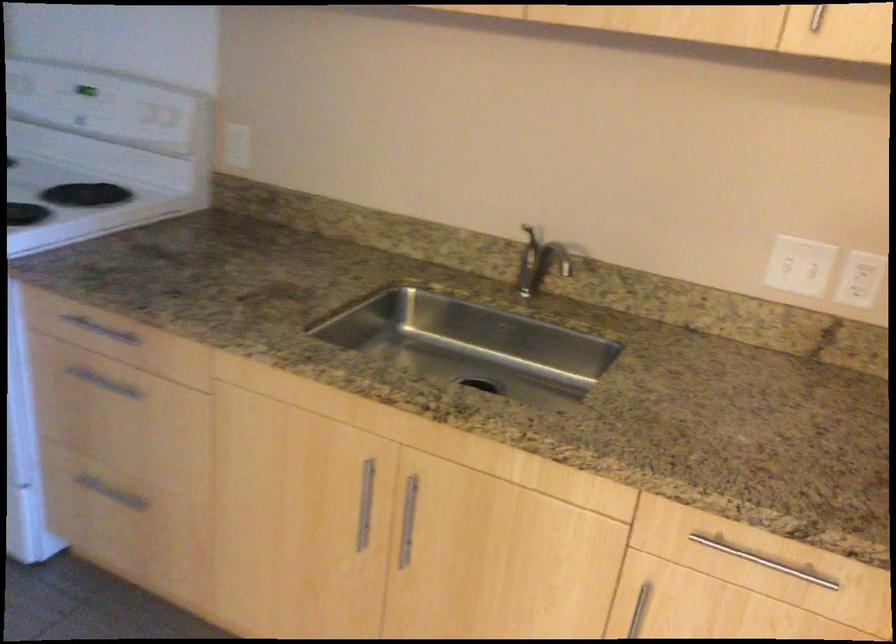
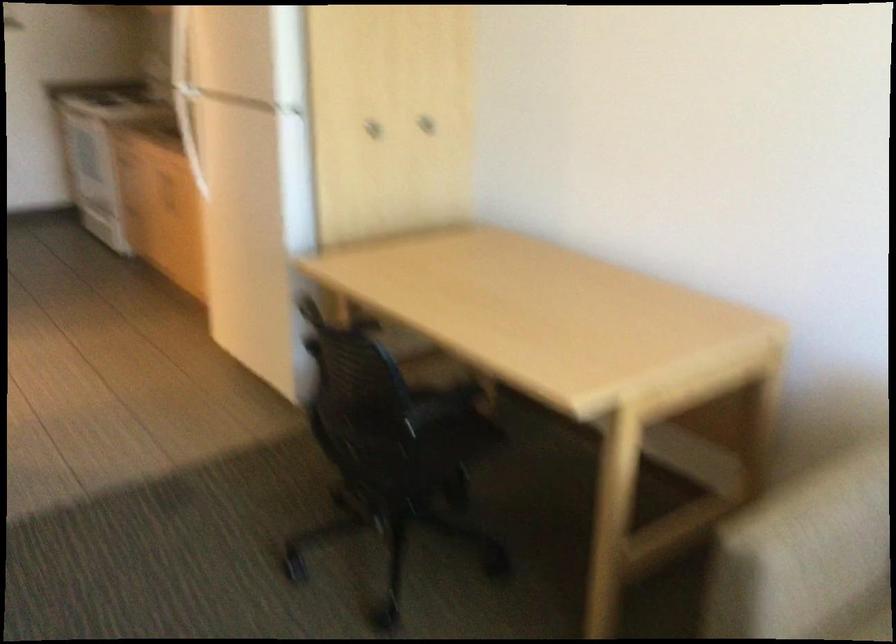
Question: I am providing you with two images of the same scene from different viewpoints. Which of the following objects are not visible in image2?

Choices:
 (A) black circular handle
 (B) cabinet door knob
 (C) white rocker switch
 (D) refrigerator door handle

Answer: (C)